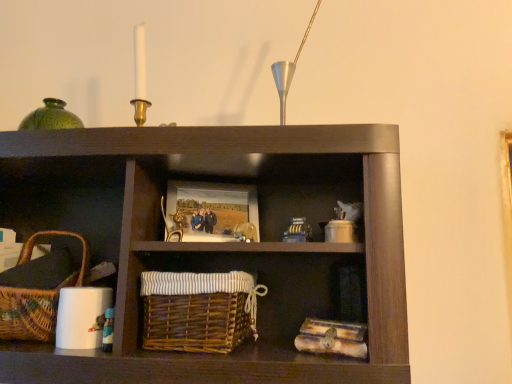
Question: Can you confirm if brown wicker basket at center is smaller than wooden picture frame at center?

Choices:
 (A) yes
 (B) no

Answer: (B)

Question: Could wooden picture frame at center be considered to be inside brown wicker basket at center?

Choices:
 (A) no
 (B) yes

Answer: (A)

Question: Considering the relative positions of brown wicker basket at center and wooden picture frame at center in the image provided, is brown wicker basket at center to the right of wooden picture frame at center from the viewer's perspective?

Choices:
 (A) yes
 (B) no

Answer: (B)

Question: Can you confirm if brown wicker basket at center is bigger than wooden picture frame at center?

Choices:
 (A) yes
 (B) no

Answer: (A)

Question: From a real-world perspective, is brown wicker basket at center positioned over wooden picture frame at center based on gravity?

Choices:
 (A) no
 (B) yes

Answer: (A)

Question: Looking at the image, does brown wicker basket at center seem bigger or smaller compared to wooden picture frame at center?

Choices:
 (A) big
 (B) small

Answer: (A)

Question: Based on their positions, is brown wicker basket at center located to the left or right of wooden picture frame at center?

Choices:
 (A) left
 (B) right

Answer: (A)

Question: From a real-world perspective, relative to wooden picture frame at center, is brown wicker basket at center vertically above or below?

Choices:
 (A) below
 (B) above

Answer: (A)

Question: From the image's perspective, is brown wicker basket at center located above or below wooden picture frame at center?

Choices:
 (A) above
 (B) below

Answer: (B)

Question: Would you say wooden picture frame at center is to the left or to the right of woven brown picnic basket at lower left in the picture?

Choices:
 (A) left
 (B) right

Answer: (B)

Question: Is wooden picture frame at center bigger or smaller than woven brown picnic basket at lower left?

Choices:
 (A) small
 (B) big

Answer: (A)

Question: In terms of width, does wooden picture frame at center look wider or thinner when compared to woven brown picnic basket at lower left?

Choices:
 (A) thin
 (B) wide

Answer: (A)

Question: From a real-world perspective, relative to woven brown picnic basket at lower left, is wooden picture frame at center vertically above or below?

Choices:
 (A) below
 (B) above

Answer: (B)

Question: Is wooden picture frame at center spatially inside brown wicker basket at center, or outside of it?

Choices:
 (A) inside
 (B) outside

Answer: (B)

Question: Is wooden picture frame at center to the left or to the right of brown wicker basket at center in the image?

Choices:
 (A) right
 (B) left

Answer: (A)